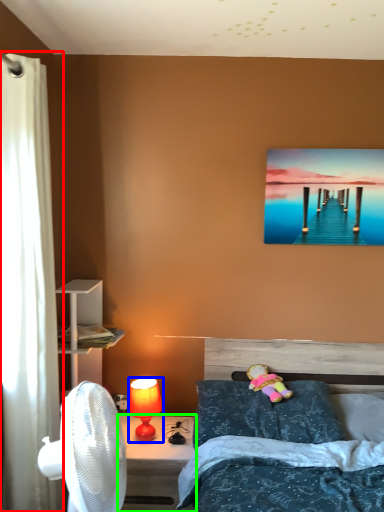
Question: Estimate the real-world distances between objects in this image. Which object is farther from curtain (highlighted by a red box), lamp (highlighted by a blue box) or desk (highlighted by a green box)?

Choices:
 (A) lamp
 (B) desk

Answer: (A)